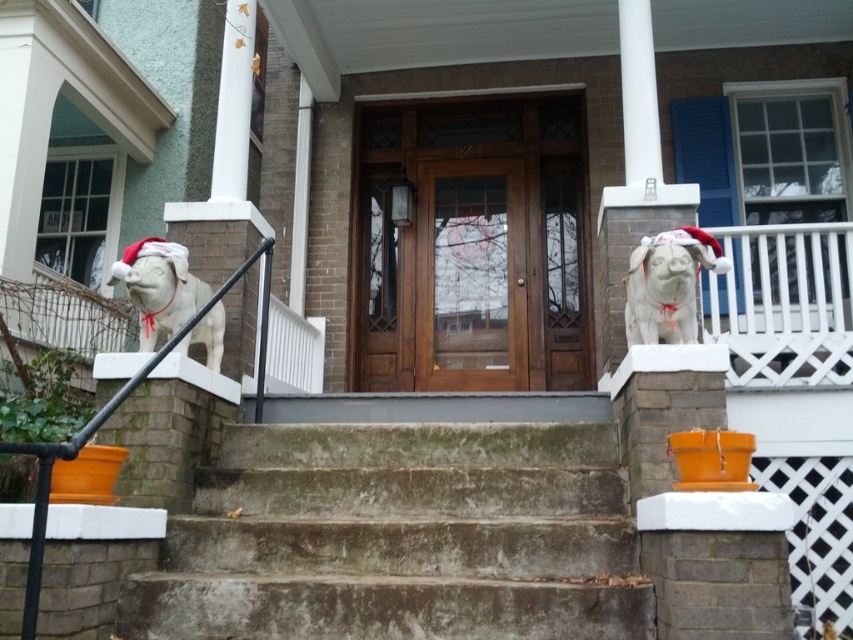
Does concrete steps at center have a lesser width compared to white stone dog at center?

→ No.

Does point (468, 486) lie behind point (694, 317)?

No, (468, 486) is in front of (694, 317).

Find the location of `concrete steps at center`. concrete steps at center is located at coordinates (399, 538).

Looking at this image, is the position of concrete steps at center less distant than that of white stone dog at left?

Yes, concrete steps at center is in front of white stone dog at left.

Does concrete steps at center come behind white stone dog at left?

No.

Which is behind, point (282, 468) or point (155, 246)?

The point (155, 246) is more distant.

The width and height of the screenshot is (853, 640). Find the location of `concrete steps at center`. concrete steps at center is located at coordinates (399, 538).

Is concrete steps at center shorter than wooden door at center?

Indeed, concrete steps at center has a lesser height compared to wooden door at center.

Between point (607, 628) and point (474, 180), which one is positioned in front?

Positioned in front is point (607, 628).

Find the location of `concrete steps at center`. concrete steps at center is located at coordinates (399, 538).